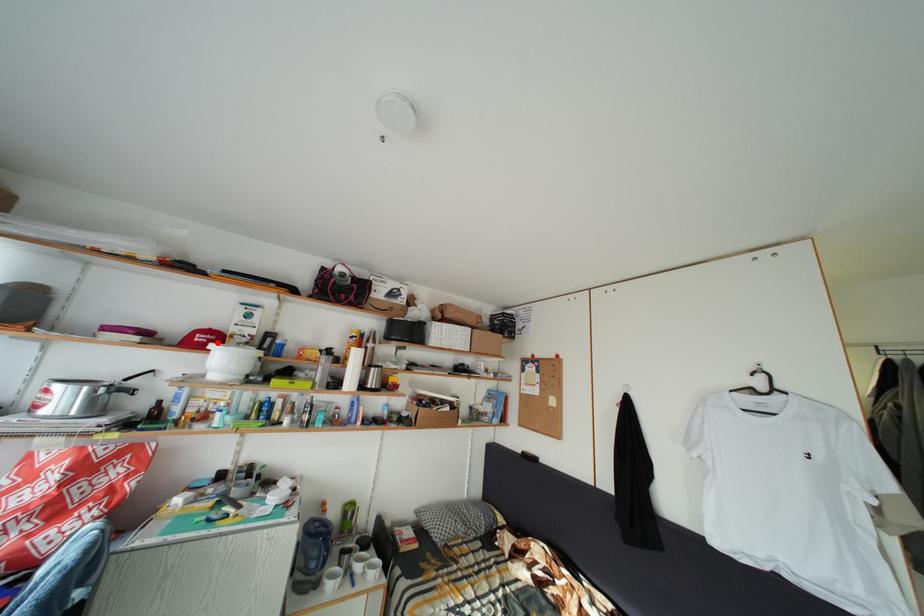
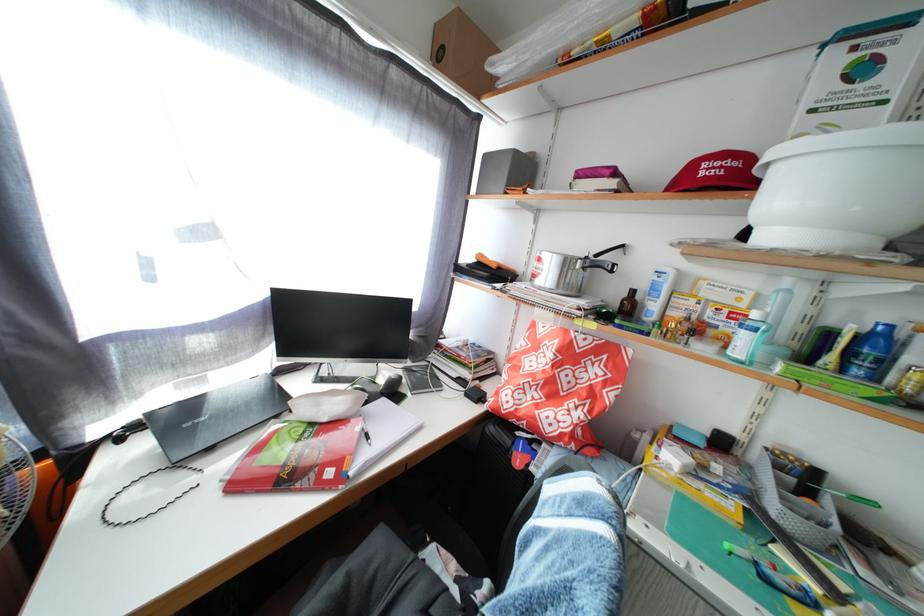
Where in the second image is the point corresponding to the highlighted location from the first image?

(736, 169)